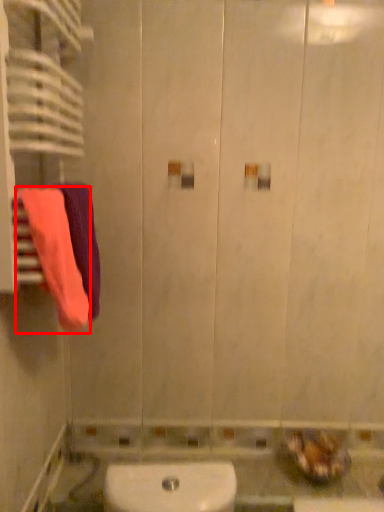
Question: From the image, what is the correct spatial relationship of towel (annotated by the red box) in relation to towel?

Choices:
 (A) left
 (B) right

Answer: (A)